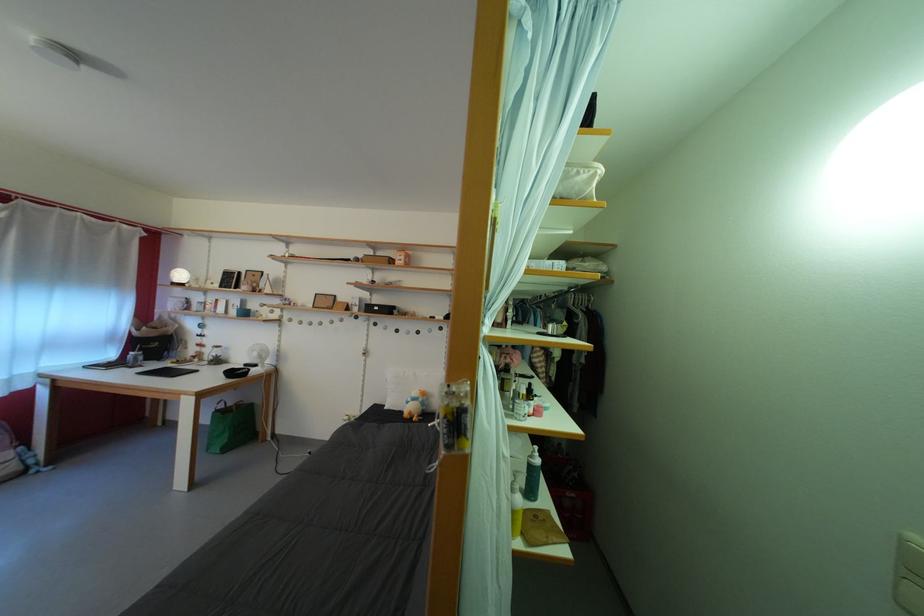
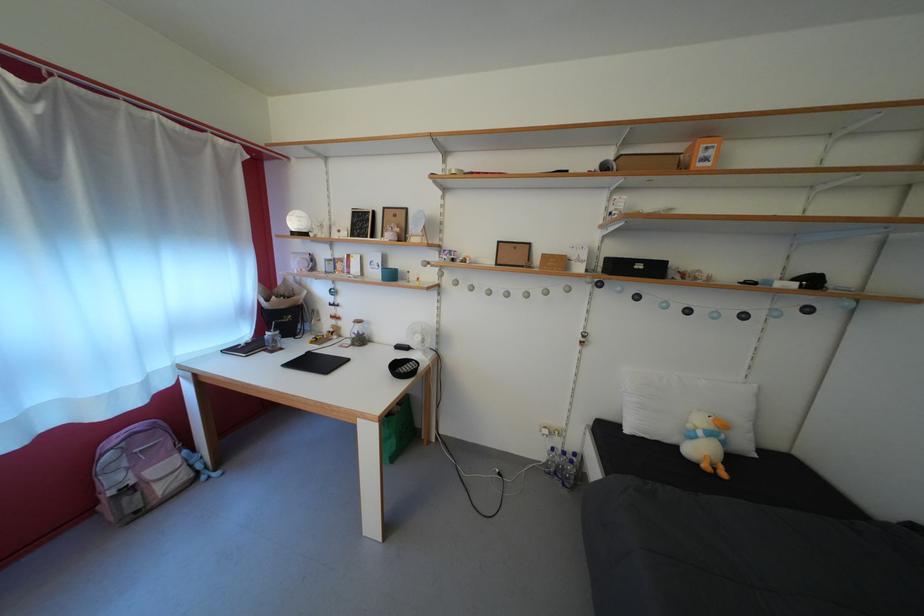
Find the pixel in the second image that matches the point at 219,360 in the first image.

(358, 334)